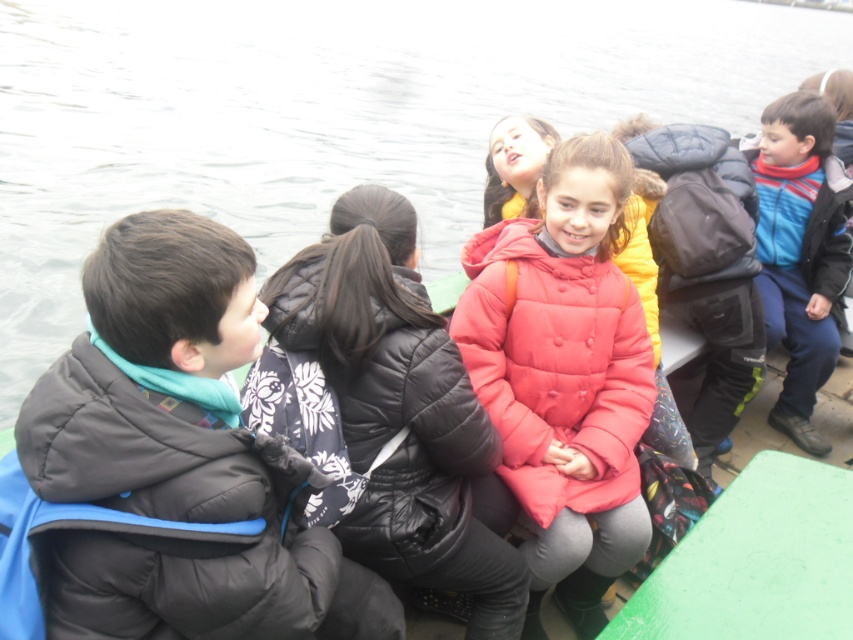
Question: Is transparent water at upper center above puffy red jacket at center?

Choices:
 (A) no
 (B) yes

Answer: (B)

Question: Estimate the real-world distances between objects in this image. Which object is farther from the blue fleece jacket at right?

Choices:
 (A) puffy red jacket at center
 (B) matte black jacket at left

Answer: (B)

Question: Among these points, which one is nearest to the camera?

Choices:
 (A) (6, 45)
 (B) (842, 284)
 (C) (457, 410)
 (D) (123, 502)

Answer: (D)

Question: Is matte black jacket at left above puffy red jacket at center?

Choices:
 (A) yes
 (B) no

Answer: (B)

Question: Can you confirm if transparent water at upper center is thinner than black quilted jacket at center?

Choices:
 (A) yes
 (B) no

Answer: (B)

Question: Which object is the closest to the matte black jacket at left?

Choices:
 (A) puffy red jacket at center
 (B) blue fleece jacket at right
 (C) transparent water at upper center
 (D) black quilted jacket at center

Answer: (D)